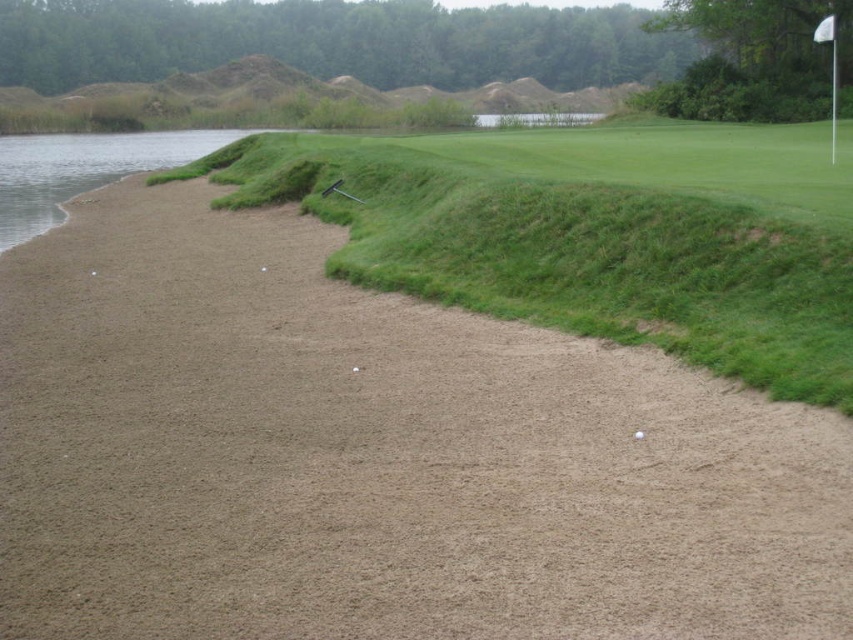
Question: Can you confirm if brown sandy bunker at center-left is smaller than green grass at center?

Choices:
 (A) no
 (B) yes

Answer: (B)

Question: Is brown sandy bunker at center-left to the left of white matte golf ball at center from the viewer's perspective?

Choices:
 (A) yes
 (B) no

Answer: (A)

Question: Which object is the farthest from the brown sandy bunker at center-left?

Choices:
 (A) white matte golf ball at center
 (B) green grass at center

Answer: (B)

Question: Among these points, which one is nearest to the camera?

Choices:
 (A) (637, 435)
 (B) (473, 364)
 (C) (517, 216)

Answer: (A)

Question: Which object is closer to the camera taking this photo?

Choices:
 (A) white matte golf ball at center
 (B) brown sandy bunker at center-left
 (C) green grass at center

Answer: (B)

Question: Can you confirm if brown sandy bunker at center-left is thinner than white matte golf ball at center?

Choices:
 (A) no
 (B) yes

Answer: (A)